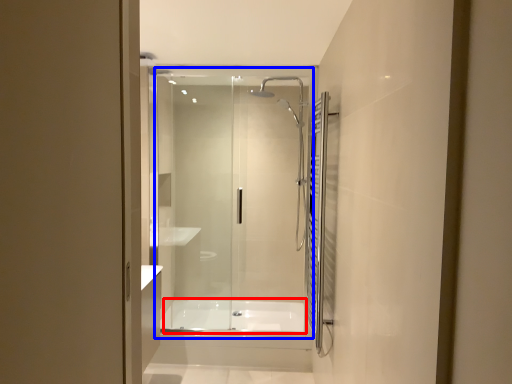
Question: Which object is further to the camera taking this photo, bath (highlighted by a red box) or glass door (highlighted by a blue box)?

Choices:
 (A) bath
 (B) glass door

Answer: (A)